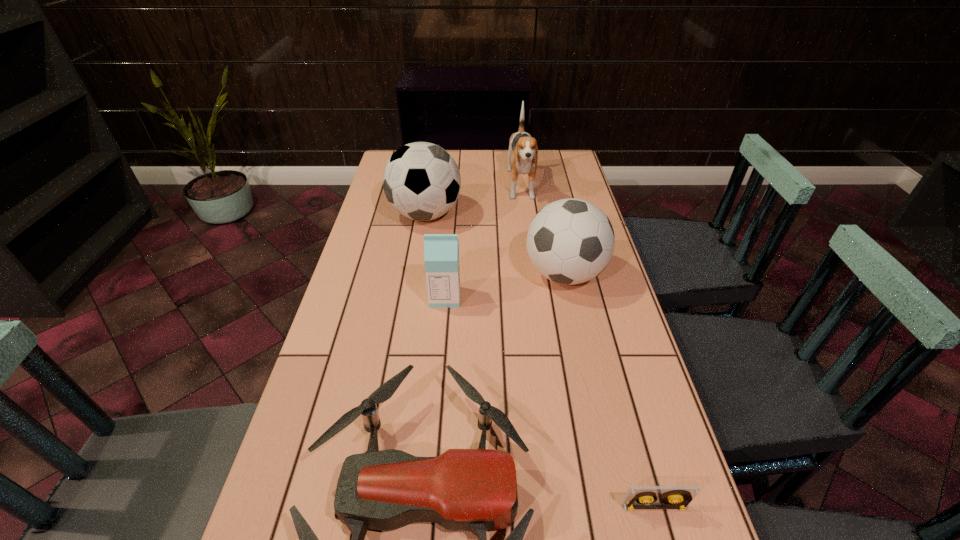
The height and width of the screenshot is (540, 960). I want to click on puppy, so click(x=523, y=151).

You are a GUI agent. You are given a task and a screenshot of the screen. Output one action in this format:
    pyautogui.click(x=<x>, y=<y>)
    Task: Click on the farther soccer ball
    Image resolution: width=960 pixels, height=540 pixels.
    Given the screenshot: What is the action you would take?
    pyautogui.click(x=421, y=180)

The height and width of the screenshot is (540, 960). Find the location of `the right soccer ball`. the right soccer ball is located at coordinates (570, 241).

Identify the location of milk carton. (441, 251).

In order to click on videotape in this screenshot , I will do `click(637, 497)`.

Locate an element on the screen. This screenshot has height=540, width=960. free space located 0.290m at the face of the puppy is located at coordinates (531, 265).

Locate an element on the screen. This screenshot has height=540, width=960. vacant space situated on the main logo of the farther soccer ball is located at coordinates (571, 214).

The height and width of the screenshot is (540, 960). I want to click on vacant space positioned 0.190m on the front of the nearer soccer ball, so click(583, 359).

What are the coordinates of `free space located on the left of the milk carton` in the screenshot? It's located at (391, 297).

This screenshot has width=960, height=540. Find the location of `object at the far edge`. object at the far edge is located at coordinates (523, 151).